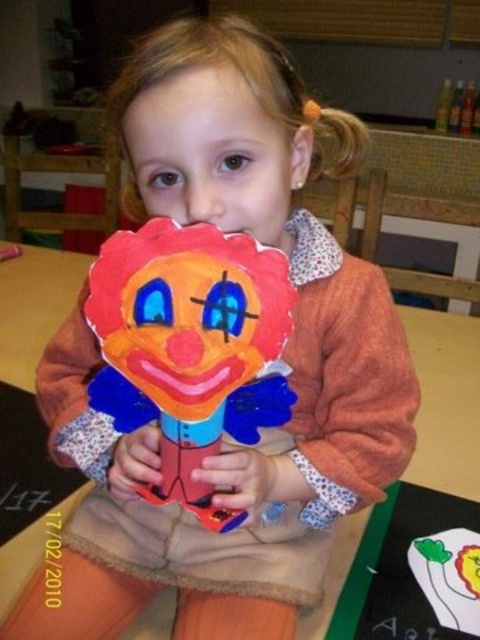
Question: Is matte paper clown at center positioned at the back of matte plastic clown at center?

Choices:
 (A) no
 (B) yes

Answer: (A)

Question: Which point is closer to the camera taking this photo?

Choices:
 (A) (243, 481)
 (B) (284, 387)

Answer: (B)

Question: From the image, what is the correct spatial relationship of matte paper clown at center in relation to matte paper hand at center?

Choices:
 (A) left
 (B) right

Answer: (A)

Question: Does matte paper clown at center have a greater width compared to matte paper hand at center?

Choices:
 (A) no
 (B) yes

Answer: (B)

Question: Which point is farther from the camera taking this photo?

Choices:
 (A) (134, 433)
 (B) (259, 493)

Answer: (A)

Question: Which point is closer to the camera?

Choices:
 (A) (119, 456)
 (B) (156, 257)
 (C) (231, 486)

Answer: (B)